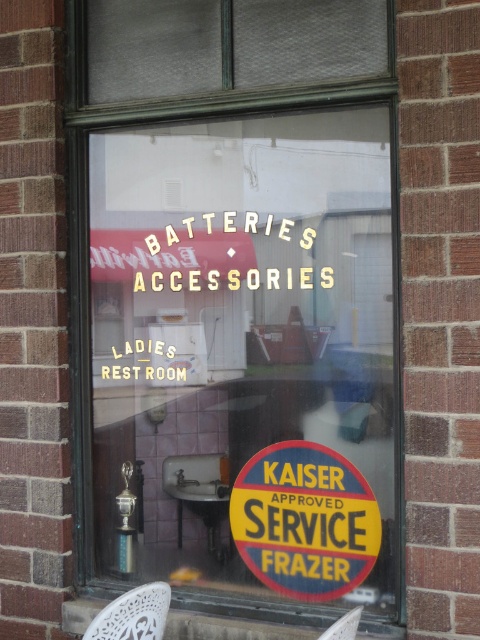
Question: Is white lace chair at lower left smaller than white plastic chair at lower right?

Choices:
 (A) yes
 (B) no

Answer: (B)

Question: Which object appears closest to the camera in this image?

Choices:
 (A) yellowmattesign at center
 (B) white lace chair at lower left

Answer: (B)

Question: Does yellowmattesign at center appear over white lace chair at lower left?

Choices:
 (A) yes
 (B) no

Answer: (A)

Question: Which point appears closest to the camera in this image?

Choices:
 (A) (110, 620)
 (B) (253, 458)

Answer: (A)

Question: Estimate the real-world distances between objects in this image. Which object is farther from the yellowmattesign at center?

Choices:
 (A) white plastic chair at lower right
 (B) white lace chair at lower left

Answer: (B)

Question: Is yellowmattesign at center positioned behind white plastic chair at lower right?

Choices:
 (A) no
 (B) yes

Answer: (B)